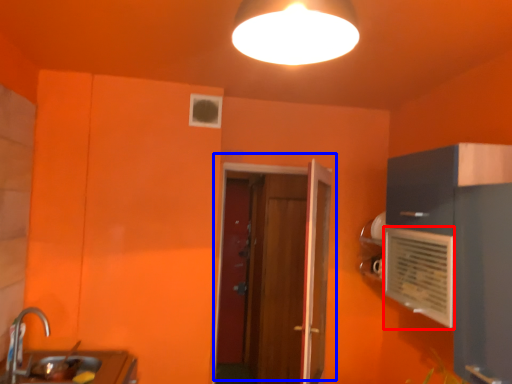
Question: Which of the following is the farthest to the observer, air conditioning (highlighted by a red box) or door (highlighted by a blue box)?

Choices:
 (A) air conditioning
 (B) door

Answer: (B)